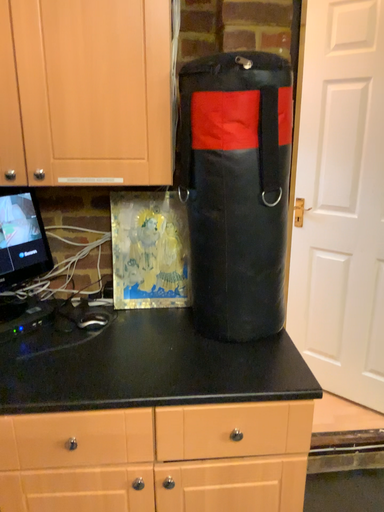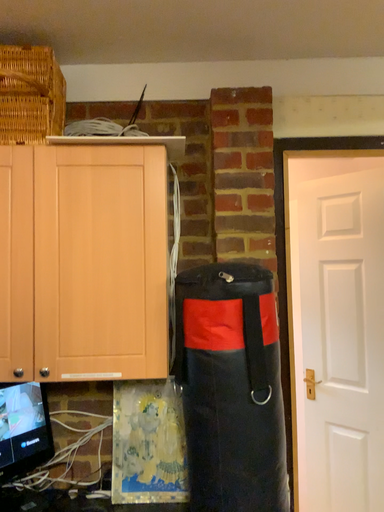
Question: Which way did the camera rotate in the video?

Choices:
 (A) rotated downward
 (B) rotated upward

Answer: (B)